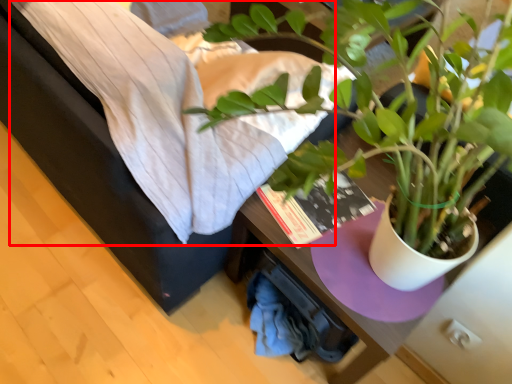
Question: From the image's perspective, where is sheet (annotated by the red box) located relative to houseplant?

Choices:
 (A) below
 (B) above

Answer: (B)